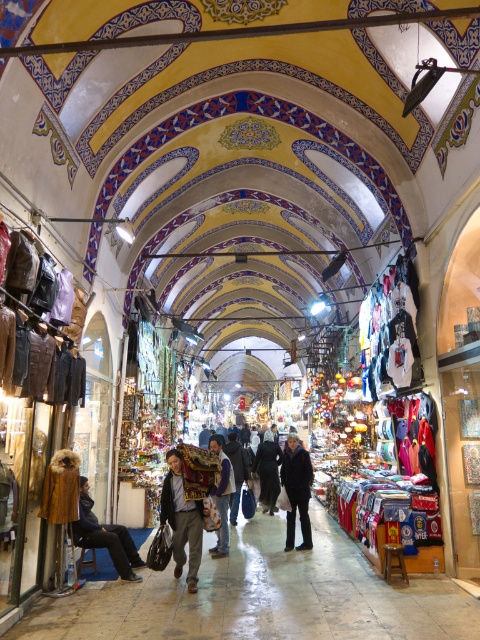
From the picture: Is leather jacket at center shorter than light brown leather jacket at center?

No.

Is point (215, 547) positioned after point (229, 515)?

No, (215, 547) is closer to viewer.

You are a GUI agent. You are given a task and a screenshot of the screen. Output one action in this format:
    pyautogui.click(x=<x>, y=<y>)
    Task: Click on the leather jacket at center
    
    Given the screenshot: What is the action you would take?
    pyautogui.click(x=222, y=497)

Which is above, leather jacket at center or dark blue fabric at center?

Positioned higher is leather jacket at center.

Which is behind, point (228, 506) or point (264, 483)?

Point (264, 483)

Is point (223, 452) positioned after point (268, 512)?

No, it is not.

Where is `leather jacket at center`? Image resolution: width=480 pixels, height=640 pixels. leather jacket at center is located at coordinates (222, 497).

Can you confirm if dark gray fabric jacket at center is smaller than light brown leather jacket at center?

Yes, dark gray fabric jacket at center is smaller than light brown leather jacket at center.

Can you confirm if dark gray fabric jacket at center is taller than light brown leather jacket at center?

Yes, dark gray fabric jacket at center is taller than light brown leather jacket at center.

What do you see at coordinates (181, 518) in the screenshot?
I see `dark gray fabric jacket at center` at bounding box center [181, 518].

Where is `dark gray fabric jacket at center`? The width and height of the screenshot is (480, 640). dark gray fabric jacket at center is located at coordinates (181, 518).